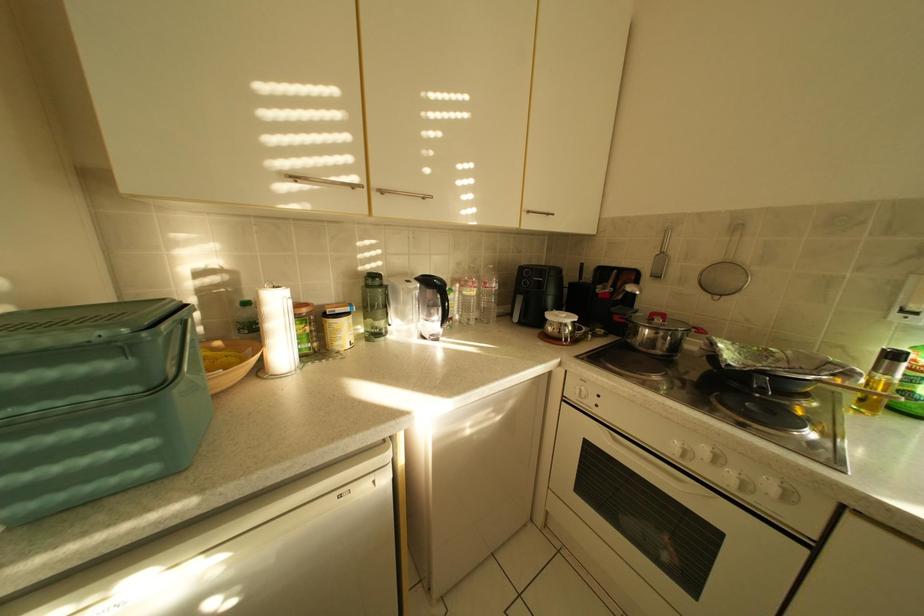
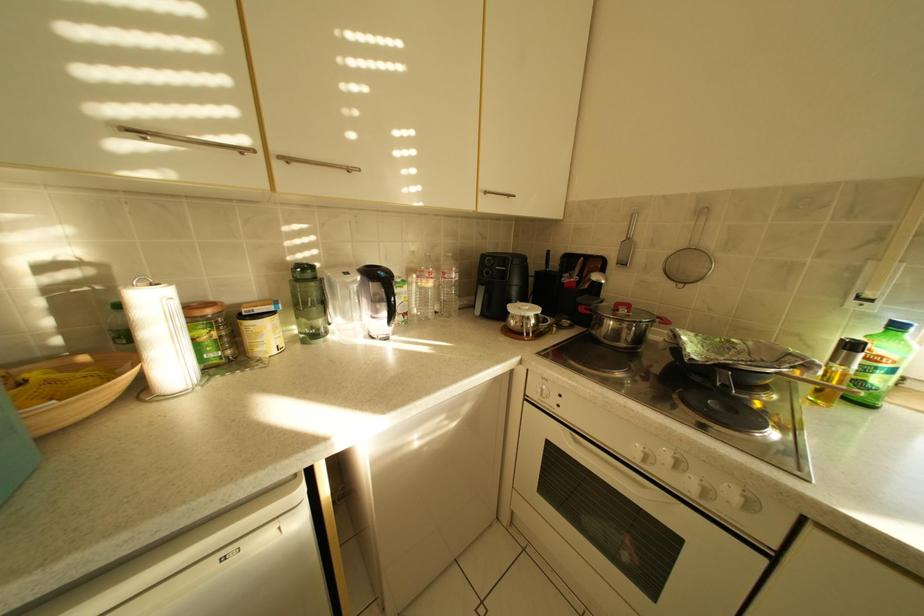
Question: The camera is either moving clockwise (left) or counter-clockwise (right) around the object. The first image is from the beginning of the video and the second image is from the end. Is the camera moving left or right when shooting the video?

Choices:
 (A) Left
 (B) Right

Answer: (A)